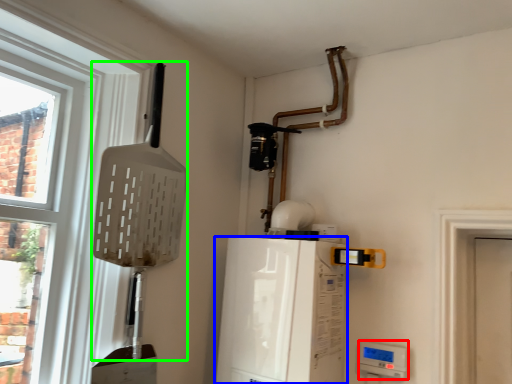
Question: Estimate the real-world distances between objects in this image. Which object is farther from appliance (highlighted by a red box), appliance (highlighted by a blue box) or shovel (highlighted by a green box)?

Choices:
 (A) appliance
 (B) shovel

Answer: (B)